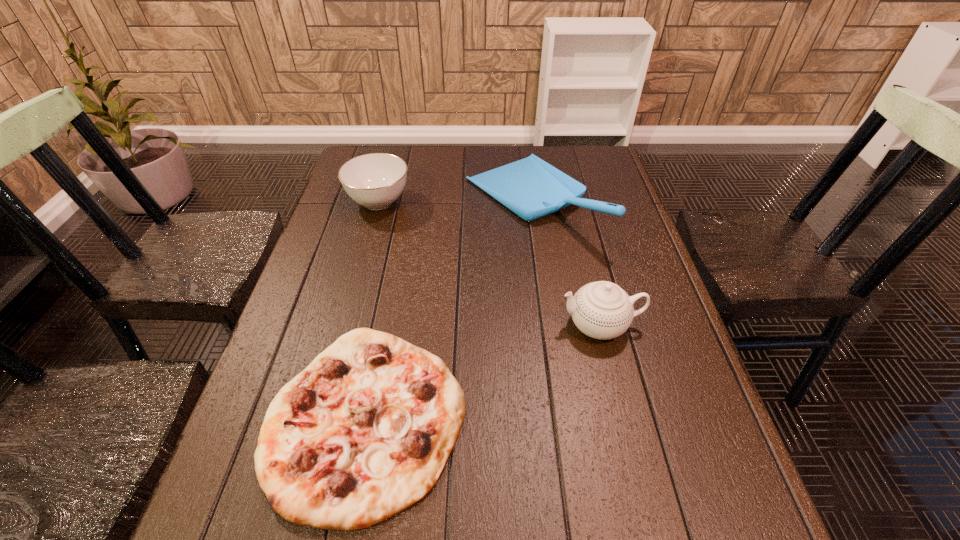
Identify the location of vacant area that lies between the pizza and the right chinaware. Image resolution: width=960 pixels, height=540 pixels. (483, 372).

Find the location of a particular element. This screenshot has height=540, width=960. vacant area between the third tallest object and the right chinaware is located at coordinates (490, 263).

Where is `free area in between the third shortest object and the dustpan`? free area in between the third shortest object and the dustpan is located at coordinates (565, 263).

Find the location of a particular element. Image resolution: width=960 pixels, height=540 pixels. blank region between the shorter chinaware and the dustpan is located at coordinates (455, 201).

You are a GUI agent. You are given a task and a screenshot of the screen. Output one action in this format:
    pyautogui.click(x=<x>, y=<y>)
    Task: Click on the free space between the shortest object and the second tallest object
    
    Given the screenshot: What is the action you would take?
    (483, 372)

Image resolution: width=960 pixels, height=540 pixels. I want to click on blank region between the tallest object and the pizza, so click(448, 309).

Identify which object is the second nearest to the right chinaware. Please provide its 2D coordinates. Your answer should be formatted as a tuple, i.e. [(x, y)], where the tuple contains the x and y coordinates of a point satisfying the conditions above.

[(364, 432)]

Select which object appears as the closest to the dustpan. Please provide its 2D coordinates. Your answer should be formatted as a tuple, i.e. [(x, y)], where the tuple contains the x and y coordinates of a point satisfying the conditions above.

[(602, 310)]

The height and width of the screenshot is (540, 960). I want to click on free space that satisfies the following two spatial constraints: 1. on the front side of the shorter chinaware; 2. on the right side of the shortest object, so click(319, 418).

Identify the location of vacant point that satisfies the following two spatial constraints: 1. on the back side of the tallest object; 2. on the left side of the left chinaware. The width and height of the screenshot is (960, 540). pyautogui.click(x=379, y=201).